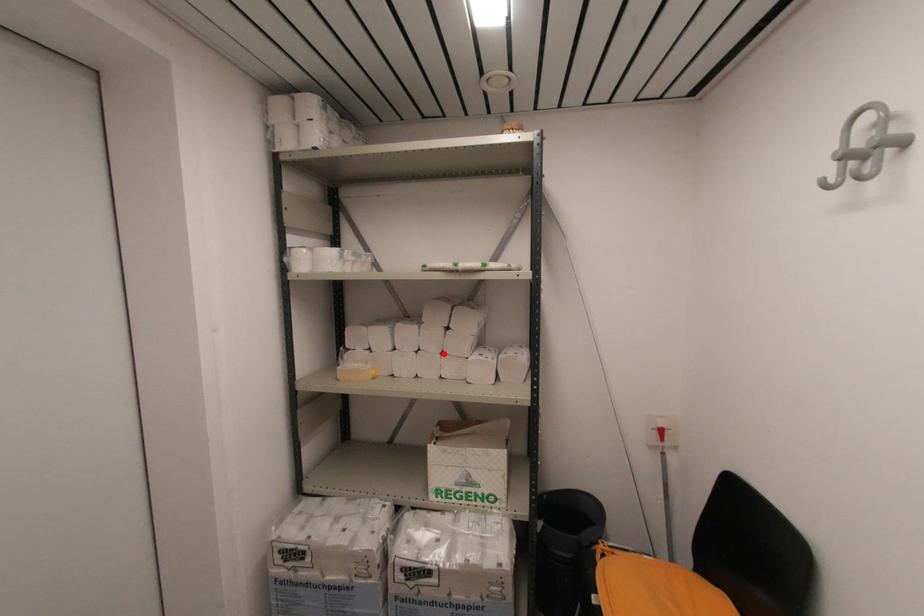
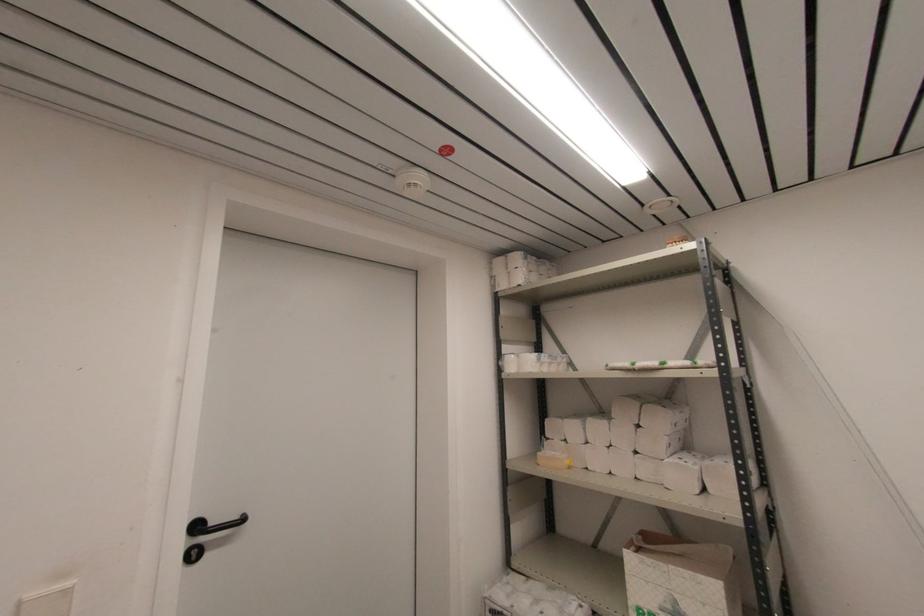
The point at the highlighted location is marked in the first image. Where is the corresponding point in the second image?

(637, 453)